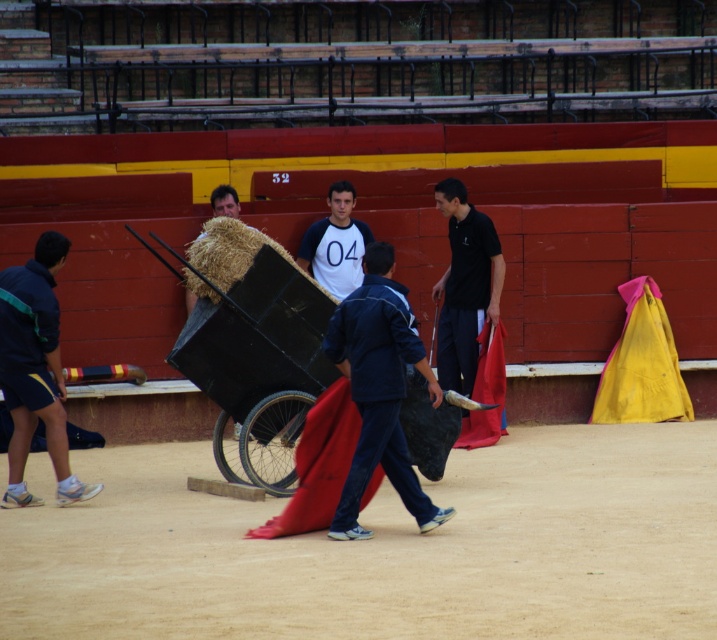
Question: Can you confirm if blue fabric at center is positioned to the left of blue fabric shorts at lower left?

Choices:
 (A) yes
 (B) no

Answer: (B)

Question: Based on their relative distances, which object is nearer to the blue fabric shorts at lower left?

Choices:
 (A) white cotton shirt at center
 (B) blue fabric at center
 (C) black smooth shirt at center

Answer: (B)

Question: Which object appears farthest from the camera in this image?

Choices:
 (A) blue fabric shorts at lower left
 (B) black smooth shirt at center
 (C) white cotton shirt at center

Answer: (C)

Question: Which is nearer to the blue fabric shorts at lower left?

Choices:
 (A) blue fabric at center
 (B) black smooth shirt at center
 (C) white cotton shirt at center

Answer: (A)

Question: Does blue fabric at center have a smaller size compared to blue fabric shorts at lower left?

Choices:
 (A) no
 (B) yes

Answer: (A)

Question: Is blue fabric shorts at lower left smaller than white cotton shirt at center?

Choices:
 (A) no
 (B) yes

Answer: (A)